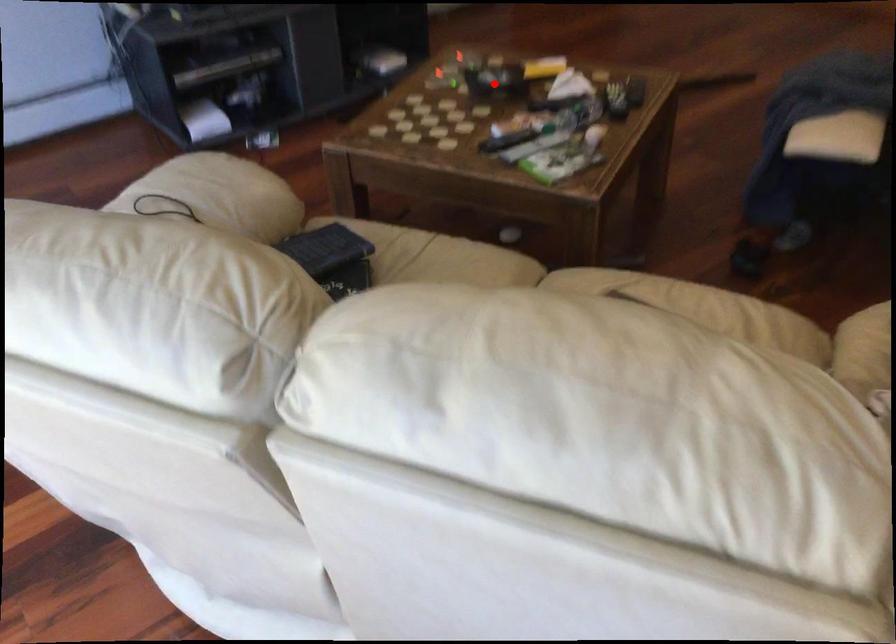
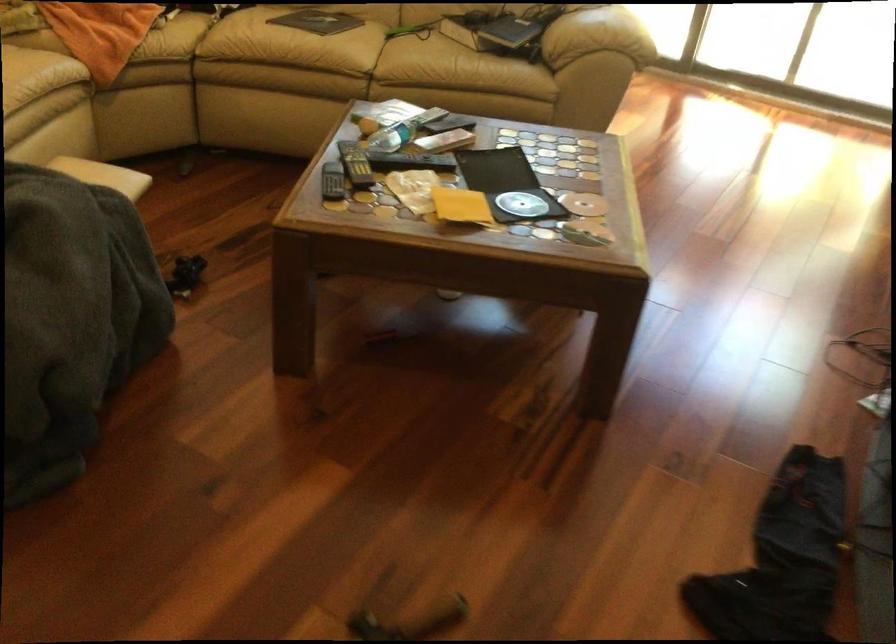
Question: I am providing you with two images of the same scene from different viewpoints. In image1, a red point is highlighted. Considering the same 3D point in image2, which of the following is correct?

Choices:
 (A) It is closer
 (B) It is farther

Answer: (A)